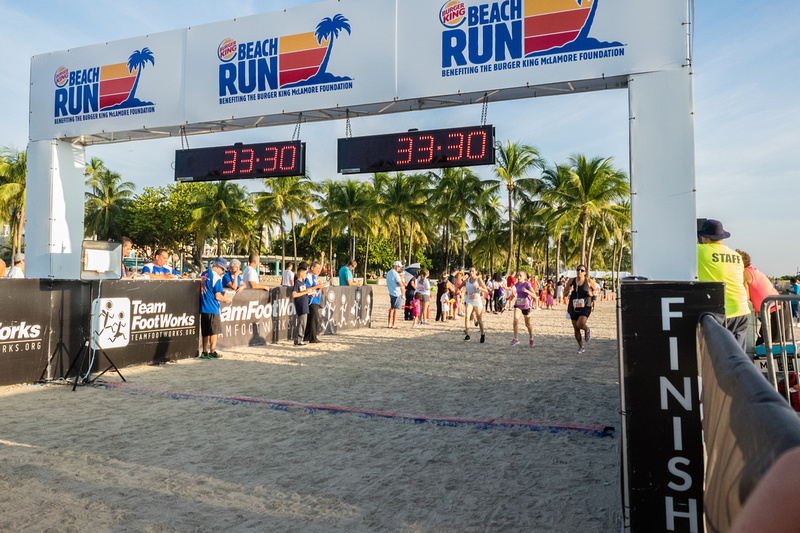
At what (x,y) coordinates should I click in order to perform the action: click on black digital clock. Please return your answer as a coordinate pair (x, y). This screenshot has width=800, height=533. Looking at the image, I should click on (188, 166), (360, 164).